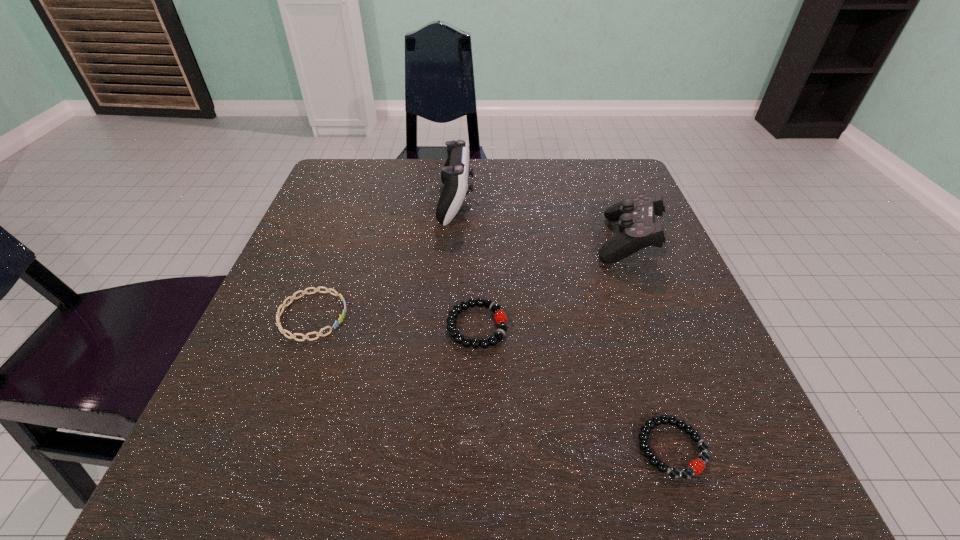
Image resolution: width=960 pixels, height=540 pixels. What are the coordinates of `free space located on the left of the second bracelet from left to right` in the screenshot? It's located at (269, 326).

At what (x,y) coordinates should I click in order to perform the action: click on free region located 0.100m on the surface of the leftmost bracelet showing star-shaped elements. Please return your answer as a coordinate pair (x, y). This screenshot has width=960, height=540. Looking at the image, I should click on (406, 316).

I want to click on vacant position located 0.270m on the back of the rightmost bracelet, so click(x=617, y=281).

Identify the location of object present at the near edge. (696, 466).

Find the location of a particular element. The image size is (960, 540). object present at the left edge is located at coordinates (292, 336).

At what (x,y) coordinates should I click in order to perform the action: click on control situated at the right edge. Please return your answer as a coordinate pair (x, y). This screenshot has height=540, width=960. Looking at the image, I should click on (635, 215).

Image resolution: width=960 pixels, height=540 pixels. Find the location of `bracelet situated at the right edge`. bracelet situated at the right edge is located at coordinates (696, 466).

Image resolution: width=960 pixels, height=540 pixels. What are the coordinates of `object present at the far right corner` in the screenshot? It's located at (635, 215).

Find the location of a particular element. The image size is (960, 540). object situated at the near right corner is located at coordinates (696, 466).

Locate an element on the screen. This screenshot has height=540, width=960. vacant space at the far edge of the desktop is located at coordinates (543, 164).